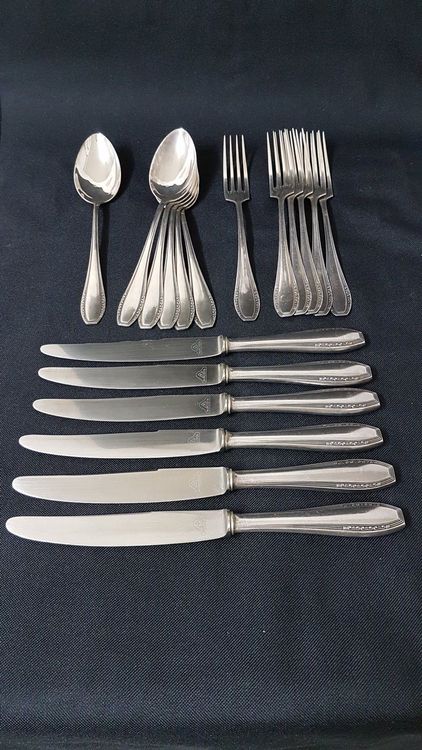
I want to click on knife handles, so click(x=356, y=519), click(x=362, y=470), click(x=349, y=429), click(x=342, y=402), click(x=337, y=376), click(x=330, y=334).